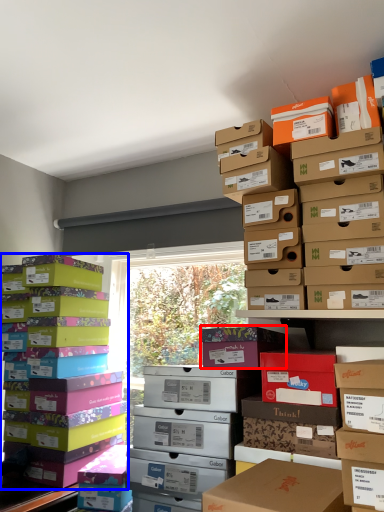
Question: Which of the following is the closest to the observer, cardboard box (highlighted by a red box) or box (highlighted by a blue box)?

Choices:
 (A) cardboard box
 (B) box

Answer: (A)